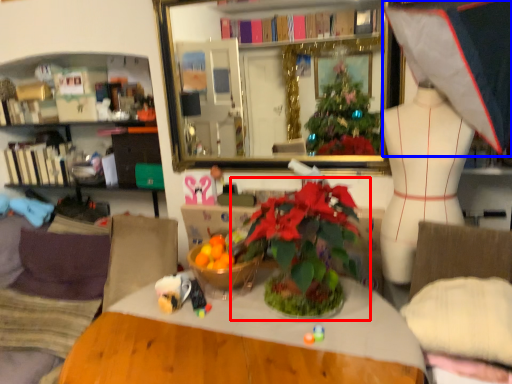
Question: Which of the following is the farthest to the observer, houseplant (highlighted by a red box) or clothing (highlighted by a blue box)?

Choices:
 (A) houseplant
 (B) clothing

Answer: (A)